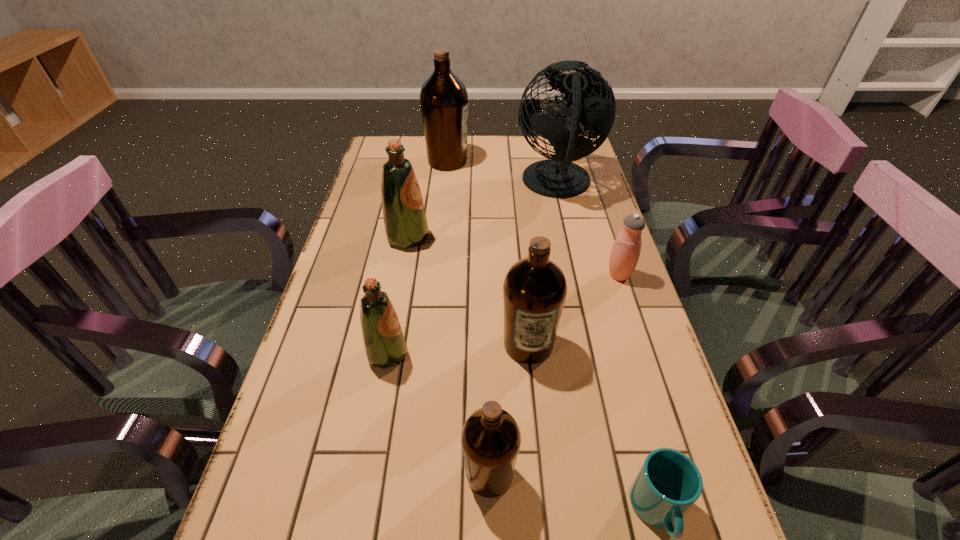
Locate an element on the screen. Image resolution: width=960 pixels, height=540 pixels. vacant space located 0.340m on the label of the nearest brown olive oil is located at coordinates (275, 474).

Find the location of a particular element. blank space located on the front of the fourth farthest object is located at coordinates 669,429.

At what (x,y) coordinates should I click in order to perform the action: click on globe present at the far edge. Please return your answer as a coordinate pair (x, y). Image resolution: width=960 pixels, height=540 pixels. Looking at the image, I should click on (593, 101).

Where is `olive oil situated at the far edge`? This screenshot has height=540, width=960. olive oil situated at the far edge is located at coordinates (444, 100).

At what (x,y) coordinates should I click in order to perform the action: click on globe that is at the right edge. Please return your answer as a coordinate pair (x, y). Looking at the image, I should click on (593, 101).

Locate an element on the screen. The width and height of the screenshot is (960, 540). thermos bottle positioned at the right edge is located at coordinates (625, 252).

Identify the location of object at the far right corner. (593, 101).

I want to click on free space at the left edge, so click(254, 494).

Identify the location of free space at the right edge. This screenshot has width=960, height=540. (576, 227).

I want to click on free area in between the farthest olive oil and the second biggest brown olive oil, so (488, 253).